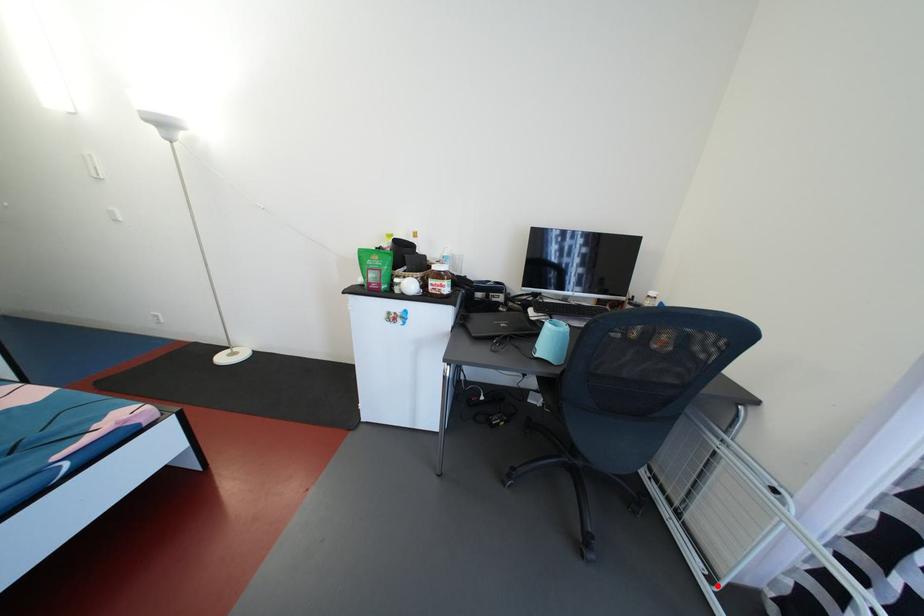
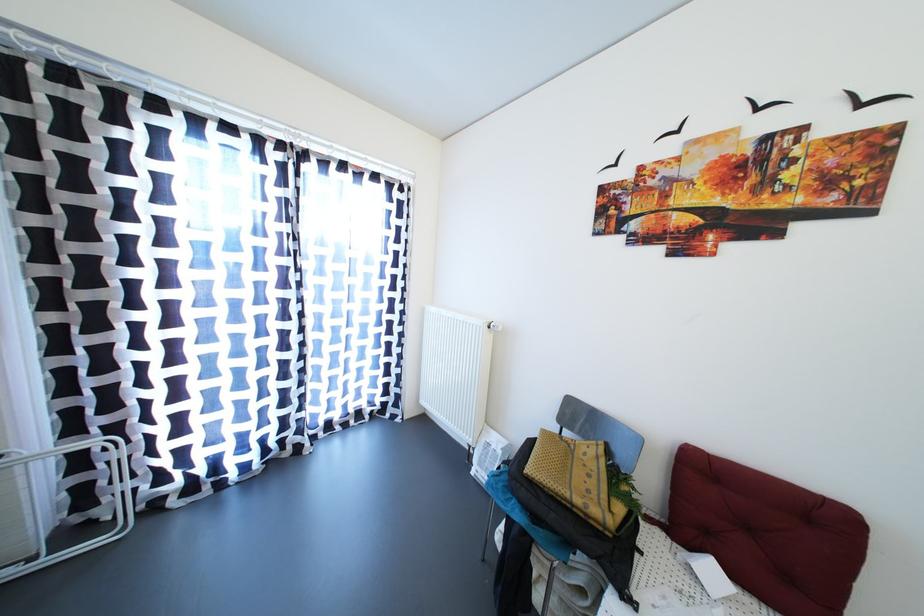
Question: I am providing you with two images of the same scene from different viewpoints. A red point is shown in image1. For the corresponding object point in image2, is it positioned nearer or farther from the camera?

Choices:
 (A) Nearer
 (B) Farther

Answer: (A)